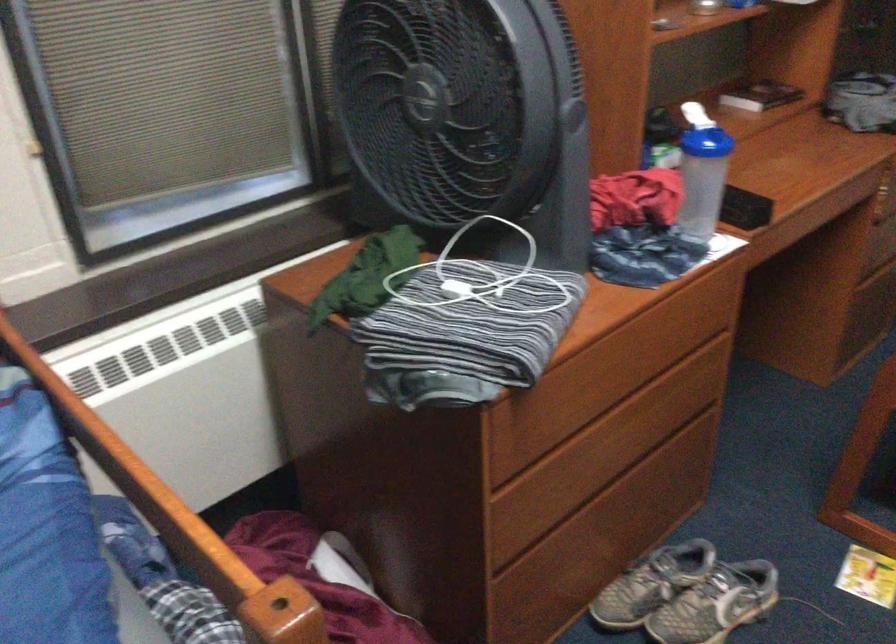
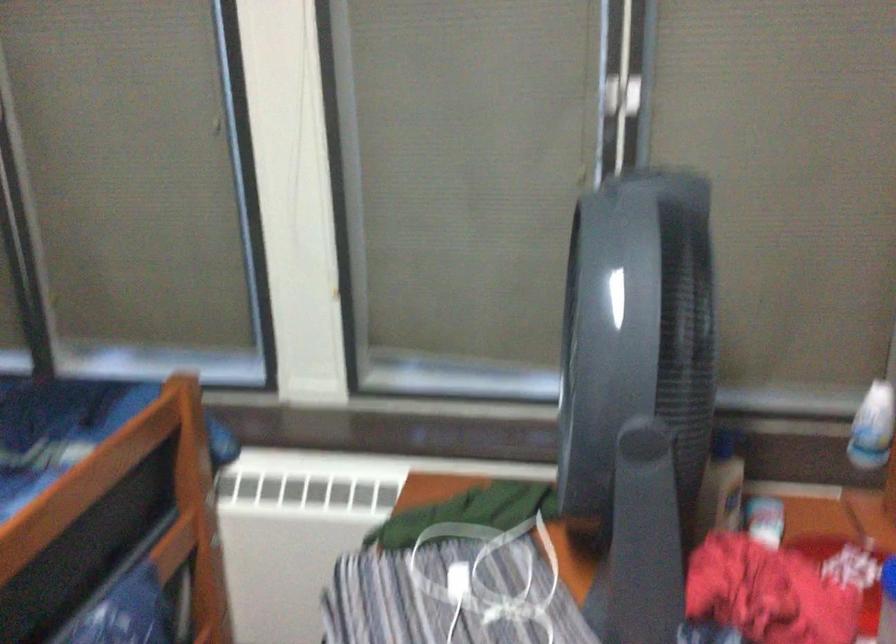
Question: The images are taken continuously from a first-person perspective. In which direction is your viewpoint rotating?

Choices:
 (A) Left
 (B) Right
 (C) Up
 (D) Down

Answer: (A)